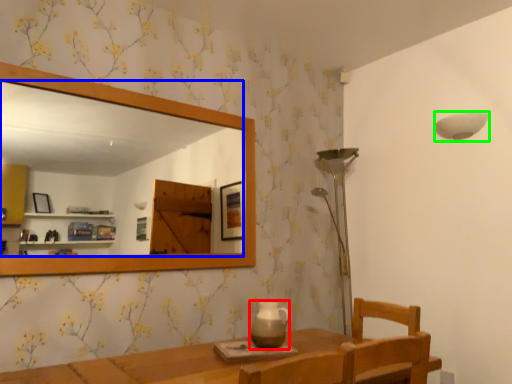
Question: Which object is positioned farthest from tea pot (highlighted by a red box)? Select from mirror (highlighted by a blue box) and lamp (highlighted by a green box).

Choices:
 (A) mirror
 (B) lamp

Answer: (A)